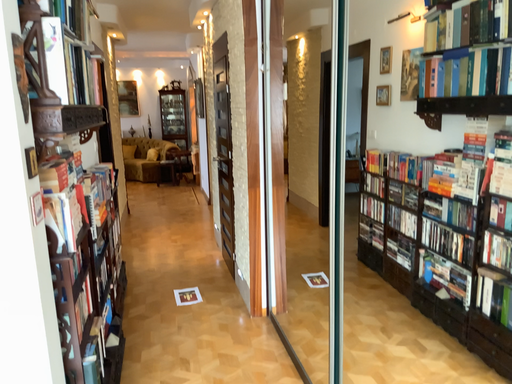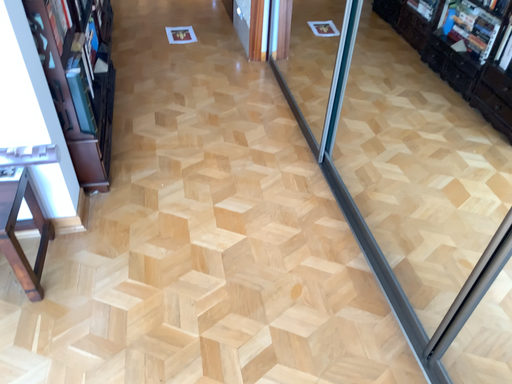
Question: Which way did the camera rotate in the video?

Choices:
 (A) rotated upward
 (B) rotated downward

Answer: (B)